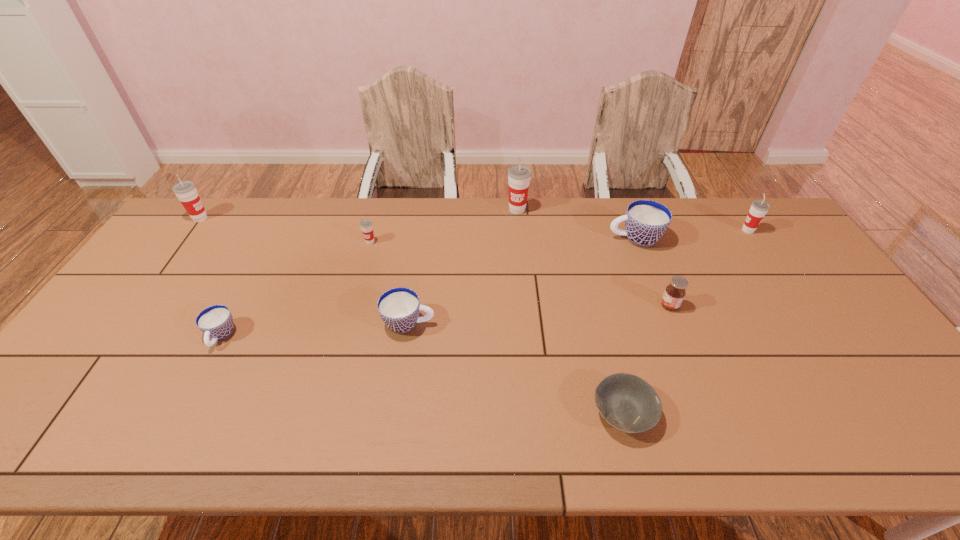
At what (x,y) coordinates should I click in order to perform the action: click on the second red cup from right to left. Please return your answer as a coordinate pair (x, y). This screenshot has width=960, height=540. Looking at the image, I should click on (519, 176).

The width and height of the screenshot is (960, 540). What are the coordinates of `the biggest red cup` in the screenshot? It's located at (519, 176).

The height and width of the screenshot is (540, 960). Find the location of `the second tallest cup`. the second tallest cup is located at coordinates (186, 191).

Locate an element on the screen. This screenshot has height=540, width=960. the second tallest object is located at coordinates (186, 191).

Identify the location of the rightmost object. The image size is (960, 540). (759, 208).

Image resolution: width=960 pixels, height=540 pixels. I want to click on the third biggest red cup, so click(759, 208).

The width and height of the screenshot is (960, 540). Identify the location of the rightmost blue cup. (646, 221).

Locate an element on the screen. The image size is (960, 540). the farthest blue cup is located at coordinates (646, 221).

Where is `the nearest red cup`? The width and height of the screenshot is (960, 540). the nearest red cup is located at coordinates (366, 225).

You are a GUI agent. You are given a task and a screenshot of the screen. Output one action in this format:
    pyautogui.click(x=<x>, y=<y>)
    Task: Click on the smallest red cup
    
    Given the screenshot: What is the action you would take?
    pyautogui.click(x=366, y=225)